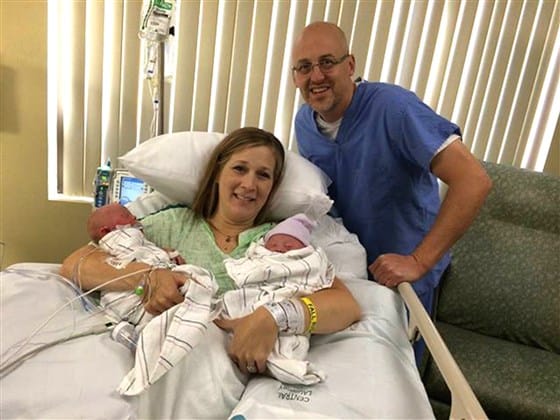
The width and height of the screenshot is (560, 420). I want to click on pillow, so click(x=184, y=155).